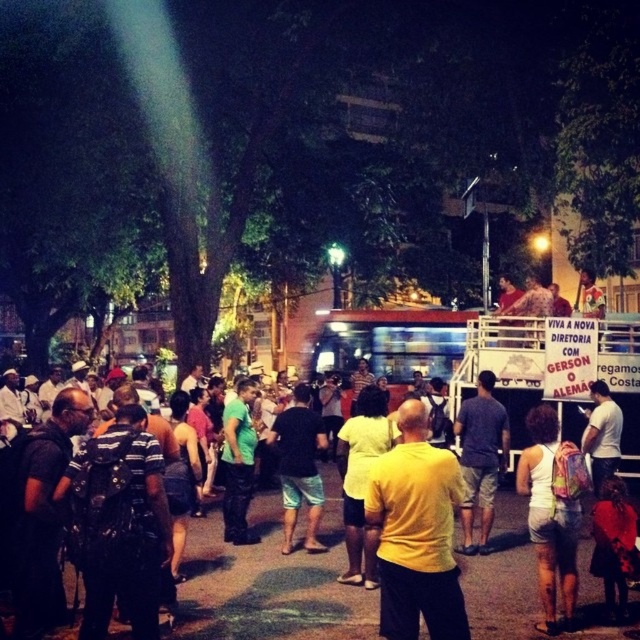
You are standing in the crowd and want to move from point A to point B. Point A is at coordinate point(333, 470) and point B is at coordinate point(557, 442). Which point is closer to you?

Point A at coordinate point(333, 470) is closer to you because it is further to the viewer than point B at coordinate point(557, 442).